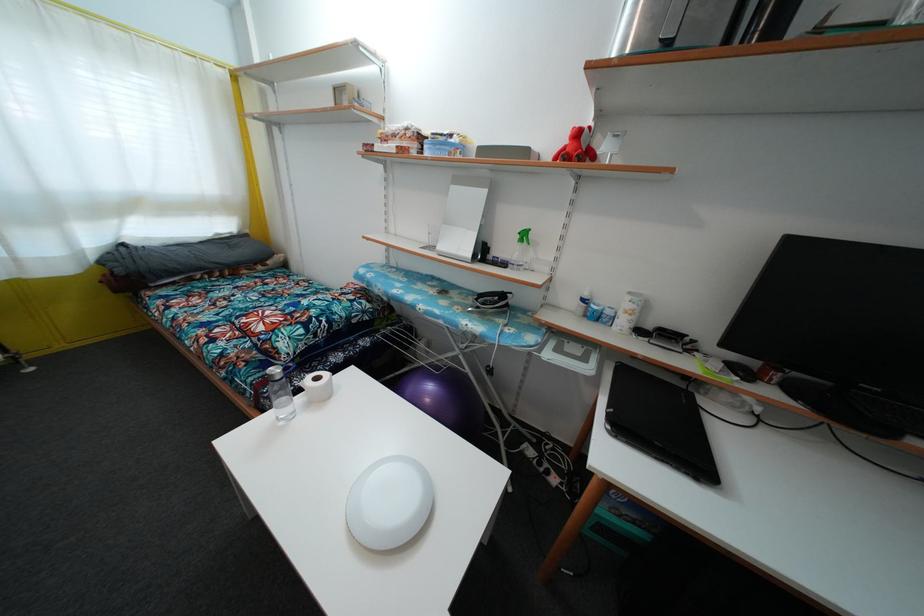
What do you see at coordinates (490, 302) in the screenshot?
I see `a black iron handle` at bounding box center [490, 302].